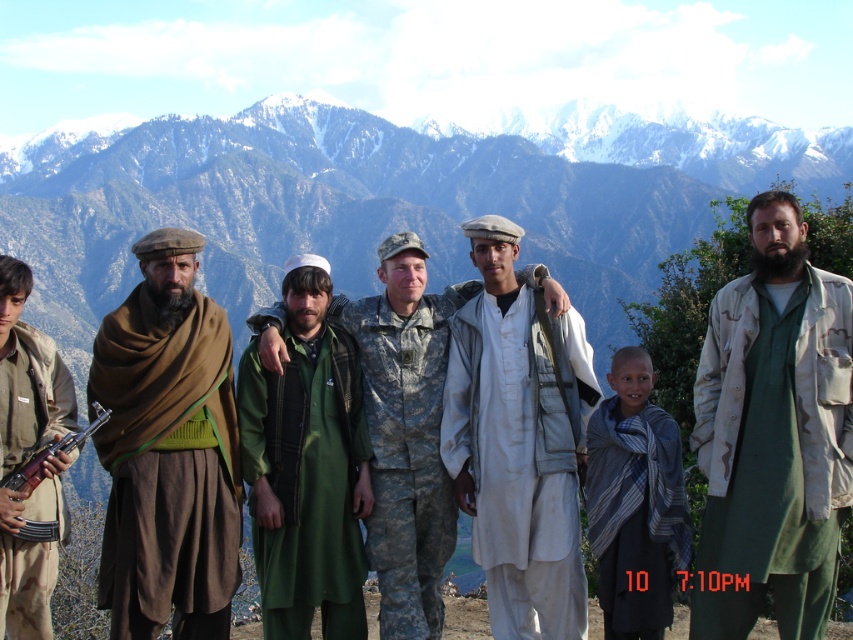
Based on the scene description, which object takes up more area in the image between the green fabric at center and the camouflage uniform at center?

The camouflage uniform at center occupies more area than the green fabric at center.

Based on the scene description, which object has a smaller size between the green cotton robe at right and the white cotton shirt at center?

The green cotton robe at right has a smaller size compared to the white cotton shirt at center.